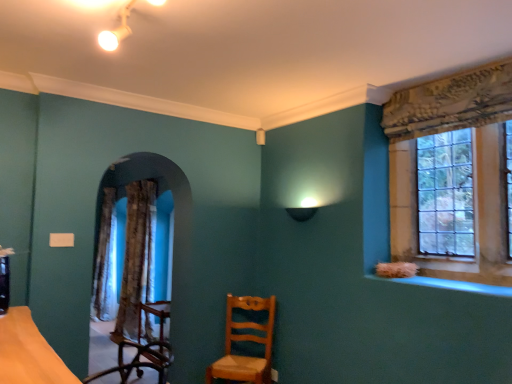
Where is `light brown wood chair at center`? The image size is (512, 384). light brown wood chair at center is located at coordinates click(245, 341).

Locate an element on the screen. This screenshot has width=512, height=384. blue glossy window sill at lower right is located at coordinates (450, 285).

Describe the element at coordinates (473, 166) in the screenshot. Image resolution: width=512 pixels, height=384 pixels. I see `clear glass window at upper right` at that location.

What do you see at coordinates (135, 258) in the screenshot?
I see `textured brown curtain at left` at bounding box center [135, 258].

Locate an element on the screen. Image resolution: width=512 pixels, height=384 pixels. light brown wood chair at center is located at coordinates [x=245, y=341].

Can you confirm if textured brown curtain at left is positioned to the left of light brown wood chair at center?

Yes, textured brown curtain at left is to the left of light brown wood chair at center.

The image size is (512, 384). In order to click on chair that appears below the textured brown curtain at left (from the image's perspective) in this screenshot , I will do `click(245, 341)`.

Which of these two, textured brown curtain at left or light brown wood chair at center, is wider?

light brown wood chair at center.

Considering the sizes of objects blue glossy window sill at lower right and clear glass window at upper right in the image provided, who is taller, blue glossy window sill at lower right or clear glass window at upper right?

clear glass window at upper right is taller.

Is blue glossy window sill at lower right at the left side of clear glass window at upper right?

Correct, you'll find blue glossy window sill at lower right to the left of clear glass window at upper right.

Which is closer, (452,288) or (484,104)?

Point (452,288) appears to be closer to the viewer than point (484,104).

Is blue glossy window sill at lower right positioned with its back to clear glass window at upper right?

No, clear glass window at upper right is not at the back of blue glossy window sill at lower right.

Looking at their sizes, would you say textured brown curtain at left is wider or thinner than blue glossy window sill at lower right?

textured brown curtain at left is thinner than blue glossy window sill at lower right.

Based on the photo, is textured brown curtain at left not within blue glossy window sill at lower right?

textured brown curtain at left is positioned outside blue glossy window sill at lower right.

Which object is closer to the camera, textured brown curtain at left or blue glossy window sill at lower right?

blue glossy window sill at lower right is more forward.

Does blue glossy window sill at lower right turn towards light brown wood chair at center?

No, blue glossy window sill at lower right is not turned towards light brown wood chair at center.

Is blue glossy window sill at lower right directly adjacent to light brown wood chair at center?

blue glossy window sill at lower right and light brown wood chair at center are not in contact.

Is point (409, 283) closer to viewer compared to point (269, 340)?

That is True.

Is light brown wood chair at center surrounded by blue glossy window sill at lower right?

That's incorrect, light brown wood chair at center is not inside blue glossy window sill at lower right.

From a real-world perspective, is light brown wood chair at center above or below textured brown curtain at left?

From a real-world perspective, light brown wood chair at center is physically below textured brown curtain at left.

How many degrees apart are the facing directions of light brown wood chair at center and textured brown curtain at left?

They differ by 37.1 degrees in their facing directions.

Is light brown wood chair at center not near textured brown curtain at left?

No.

Is light brown wood chair at center oriented away from textured brown curtain at left?

light brown wood chair at center does not have its back to textured brown curtain at left.

Are light brown wood chair at center and clear glass window at upper right located far from each other?

That's right, there is a large distance between light brown wood chair at center and clear glass window at upper right.

Looking at their sizes, would you say light brown wood chair at center is wider or thinner than clear glass window at upper right?

In the image, light brown wood chair at center appears to be wider than clear glass window at upper right.

Is light brown wood chair at center to the right of clear glass window at upper right from the viewer's perspective?

No, light brown wood chair at center is not to the right of clear glass window at upper right.

Is light brown wood chair at center shorter than clear glass window at upper right?

Correct, light brown wood chair at center is not as tall as clear glass window at upper right.

Is clear glass window at upper right inside the boundaries of textured brown curtain at left, or outside?

clear glass window at upper right cannot be found inside textured brown curtain at left.

Is clear glass window at upper right shorter than textured brown curtain at left?

Yes, clear glass window at upper right is shorter than textured brown curtain at left.

Is clear glass window at upper right in front of or behind textured brown curtain at left in the image?

Clearly, clear glass window at upper right is in front of textured brown curtain at left.

From a real-world perspective, who is located higher, clear glass window at upper right or textured brown curtain at left?

In real-world perspective, clear glass window at upper right is above.

Locate an element on the screen. This screenshot has width=512, height=384. chair that is under the textured brown curtain at left (from a real-world perspective) is located at coordinates (245, 341).

This screenshot has width=512, height=384. I want to click on window sill below the clear glass window at upper right (from the image's perspective), so click(x=450, y=285).

Looking at the image, which one is located closer to textured brown curtain at left, light brown wood chair at center or blue glossy window sill at lower right?

The object closer to textured brown curtain at left is light brown wood chair at center.

Considering their positions, is blue glossy window sill at lower right positioned closer to clear glass window at upper right than light brown wood chair at center?

blue glossy window sill at lower right is positioned closer to the anchor clear glass window at upper right.

When comparing their distances from clear glass window at upper right, does textured brown curtain at left or light brown wood chair at center seem closer?

light brown wood chair at center is positioned closer to the anchor clear glass window at upper right.

Looking at this image, when comparing their distances from blue glossy window sill at lower right, does light brown wood chair at center or clear glass window at upper right seem further?

light brown wood chair at center lies further to blue glossy window sill at lower right than the other object.

Estimate the real-world distances between objects in this image. Which object is closer to blue glossy window sill at lower right, textured brown curtain at left or clear glass window at upper right?

Based on the image, clear glass window at upper right appears to be nearer to blue glossy window sill at lower right.

Based on their spatial positions, is textured brown curtain at left or blue glossy window sill at lower right closer to light brown wood chair at center?

textured brown curtain at left is positioned closer to the anchor light brown wood chair at center.

Estimate the real-world distances between objects in this image. Which object is closer to blue glossy window sill at lower right, clear glass window at upper right or textured brown curtain at left?

clear glass window at upper right lies closer to blue glossy window sill at lower right than the other object.

Which object lies nearer to the anchor point blue glossy window sill at lower right, textured brown curtain at left or light brown wood chair at center?

light brown wood chair at center.

I want to click on window sill located between light brown wood chair at center and clear glass window at upper right in the left-right direction, so click(450, 285).

Where is `chair between clear glass window at upper right and textured brown curtain at left along the z-axis`? chair between clear glass window at upper right and textured brown curtain at left along the z-axis is located at coordinates (245, 341).

Where is `chair between blue glossy window sill at lower right and textured brown curtain at left in the front-back direction`? This screenshot has height=384, width=512. chair between blue glossy window sill at lower right and textured brown curtain at left in the front-back direction is located at coordinates (245, 341).

Locate an element on the screen. window between blue glossy window sill at lower right and textured brown curtain at left along the z-axis is located at coordinates (473, 166).